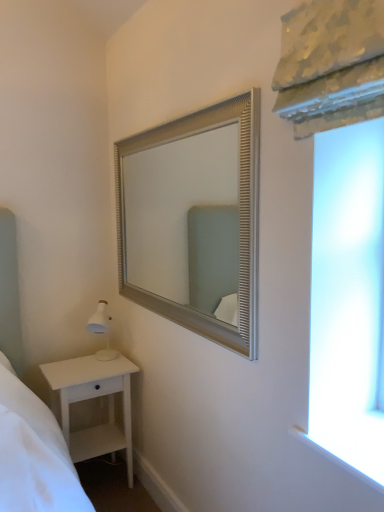
Question: Is white matte nightstand at lower left wider or thinner than silver textured mirror at upper center?

Choices:
 (A) wide
 (B) thin

Answer: (A)

Question: From the image's perspective, relative to silver textured mirror at upper center, is white matte nightstand at lower left above or below?

Choices:
 (A) below
 (B) above

Answer: (A)

Question: Choose the correct answer: Is white matte nightstand at lower left inside silver textured mirror at upper center or outside it?

Choices:
 (A) outside
 (B) inside

Answer: (A)

Question: From a real-world perspective, relative to white matte nightstand at lower left, is silver textured mirror at upper center vertically above or below?

Choices:
 (A) below
 (B) above

Answer: (B)

Question: In terms of width, does silver textured mirror at upper center look wider or thinner when compared to white matte nightstand at lower left?

Choices:
 (A) thin
 (B) wide

Answer: (A)

Question: Based on their sizes in the image, would you say silver textured mirror at upper center is bigger or smaller than white matte nightstand at lower left?

Choices:
 (A) small
 (B) big

Answer: (A)

Question: Is silver textured mirror at upper center situated inside white matte nightstand at lower left or outside?

Choices:
 (A) outside
 (B) inside

Answer: (A)